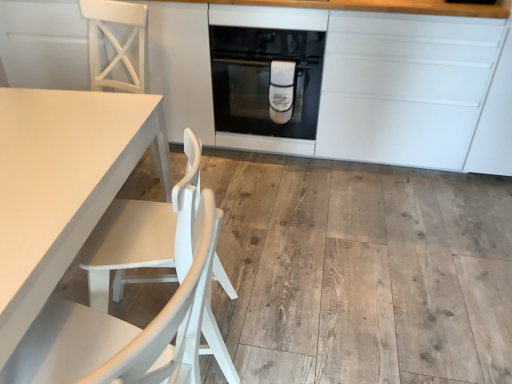
What is the approximate width of white matte wood chair at lower left, the 2th chair viewed from the back?

white matte wood chair at lower left, the 2th chair viewed from the back, is 22.01 inches wide.

I want to click on white matte wood chair at lower left, the first chair in the bottom-to-top sequence, so click(x=127, y=332).

This screenshot has width=512, height=384. In order to click on white matte chair at left, placed as the second chair when sorted from bottom to top in this screenshot , I will do `click(115, 40)`.

Describe the element at coordinates (357, 84) in the screenshot. I see `white matte cabinetry at center` at that location.

Describe the element at coordinates (264, 79) in the screenshot. The height and width of the screenshot is (384, 512). I see `black glass oven at center` at that location.

What is the approximate width of black glass oven at center?

black glass oven at center is 63.31 centimeters wide.

In order to click on white matte table at left in this screenshot , I will do `click(63, 184)`.

Does point (95, 59) come behind point (316, 71)?

Yes.

Where is `home appliance behind the white matte chair at left, placed as the second chair when sorted from bottom to top`? The height and width of the screenshot is (384, 512). home appliance behind the white matte chair at left, placed as the second chair when sorted from bottom to top is located at coordinates (264, 79).

Looking at their sizes, would you say white matte chair at left, positioned as the first chair in back-to-front order, is wider or thinner than black glass oven at center?

In the image, white matte chair at left, positioned as the first chair in back-to-front order, appears to be more narrow than black glass oven at center.

From the picture: From the image's perspective, is white matte chair at left, the second chair in the front-to-back sequence, on top of black glass oven at center?

No, from the image's perspective, white matte chair at left, the second chair in the front-to-back sequence, is not above black glass oven at center.

Which object is thinner, white matte cabinetry at center or white matte table at left?

white matte cabinetry at center is thinner.

Does white matte cabinetry at center turn towards white matte table at left?

Yes, white matte cabinetry at center is turned towards white matte table at left.

Between white matte cabinetry at center and white matte table at left, which one appears on the right side from the viewer's perspective?

Positioned to the right is white matte cabinetry at center.

What's the angular difference between white matte cabinetry at center and white matte table at left's facing directions?

The facing directions of white matte cabinetry at center and white matte table at left are 94.2 degrees apart.

Is white matte chair at left, placed as the second chair when sorted from bottom to top, not within white matte wood chair at lower left, the 2th chair in the top-to-bottom sequence?

Yes.

Is point (128, 85) more distant than point (90, 369)?

Yes, point (128, 85) is behind point (90, 369).

From the image's perspective, does white matte chair at left, the 1th chair positioned from the top, appear lower than white matte wood chair at lower left, the 2th chair viewed from the back?

No, from the image's perspective, white matte chair at left, the 1th chair positioned from the top, is not below white matte wood chair at lower left, the 2th chair viewed from the back.

Is white matte table at left wider or thinner than white matte cabinetry at center?

white matte table at left is wider than white matte cabinetry at center.

Is white matte cabinetry at center at the back of white matte table at left?

white matte table at left is not turned away from white matte cabinetry at center.

Which is in front, white matte table at left or white matte cabinetry at center?

white matte table at left is closer to the camera.

Is white matte table at left inside or outside of white matte cabinetry at center?

white matte table at left is spatially situated outside white matte cabinetry at center.

This screenshot has width=512, height=384. What are the coordinates of `home appliance behind the white matte wood chair at lower left, the 2th chair viewed from the back` in the screenshot? It's located at (264, 79).

From the image's perspective, is black glass oven at center below white matte wood chair at lower left, the 2th chair viewed from the back?

No, from the image's perspective, black glass oven at center is not beneath white matte wood chair at lower left, the 2th chair viewed from the back.

Is black glass oven at center facing towards white matte wood chair at lower left, the 2th chair viewed from the back?

Yes, black glass oven at center is turned towards white matte wood chair at lower left, the 2th chair viewed from the back.

Identify the location of chair above the white matte wood chair at lower left, the 2th chair in the top-to-bottom sequence (from the image's perspective). (115, 40).

Considering the relative sizes of white matte wood chair at lower left, acting as the first chair starting from the front, and white matte chair at left, placed as the second chair when sorted from bottom to top, in the image provided, is white matte wood chair at lower left, acting as the first chair starting from the front, shorter than white matte chair at left, placed as the second chair when sorted from bottom to top,?

No.

Is white matte wood chair at lower left, the first chair in the bottom-to-top sequence, closer to the viewer compared to white matte chair at left, the 1th chair positioned from the top?

Yes, white matte wood chair at lower left, the first chair in the bottom-to-top sequence, is in front of white matte chair at left, the 1th chair positioned from the top.

From the image's perspective, does white matte wood chair at lower left, the 2th chair in the top-to-bottom sequence, appear lower than white matte chair at left, the 1th chair positioned from the top?

Yes.

Considering the positions of objects white matte chair at left, the second chair in the front-to-back sequence, and white matte table at left in the image provided, who is more to the right, white matte chair at left, the second chair in the front-to-back sequence, or white matte table at left?

Positioned to the right is white matte table at left.

Is white matte chair at left, placed as the second chair when sorted from bottom to top, inside the boundaries of white matte table at left, or outside?

white matte chair at left, placed as the second chair when sorted from bottom to top, is not enclosed by white matte table at left.

Which object is further away from the camera, white matte chair at left, placed as the second chair when sorted from bottom to top, or white matte table at left?

Positioned behind is white matte chair at left, placed as the second chair when sorted from bottom to top.

The height and width of the screenshot is (384, 512). In order to click on home appliance below the white matte chair at left, placed as the second chair when sorted from bottom to top (from a real-world perspective) in this screenshot , I will do `click(264, 79)`.

The height and width of the screenshot is (384, 512). Identify the location of cabinetry behind the white matte table at left. (357, 84).

Based on their spatial positions, is white matte wood chair at lower left, the 2th chair in the top-to-bottom sequence, or white matte cabinetry at center further from black glass oven at center?

Among the two, white matte wood chair at lower left, the 2th chair in the top-to-bottom sequence, is located further to black glass oven at center.

Estimate the real-world distances between objects in this image. Which object is further from white matte wood chair at lower left, the 2th chair viewed from the back, white matte cabinetry at center or white matte table at left?

white matte cabinetry at center is positioned further to the anchor white matte wood chair at lower left, the 2th chair viewed from the back.

Looking at the image, which one is located closer to white matte cabinetry at center, white matte wood chair at lower left, the 2th chair viewed from the back, or white matte table at left?

white matte table at left is closer to white matte cabinetry at center.

Which object lies nearer to the anchor point black glass oven at center, white matte table at left or white matte chair at left, the second chair in the front-to-back sequence?

The object closer to black glass oven at center is white matte chair at left, the second chair in the front-to-back sequence.

Which object lies further to the anchor point white matte chair at left, the 1th chair positioned from the top, white matte cabinetry at center or white matte wood chair at lower left, the 2th chair viewed from the back?

white matte wood chair at lower left, the 2th chair viewed from the back.

When comparing their distances from white matte chair at left, the second chair in the front-to-back sequence, does white matte wood chair at lower left, the 2th chair viewed from the back, or black glass oven at center seem further?

The object further to white matte chair at left, the second chair in the front-to-back sequence, is white matte wood chair at lower left, the 2th chair viewed from the back.

Which object lies nearer to the anchor point white matte wood chair at lower left, the 2th chair in the top-to-bottom sequence, black glass oven at center or white matte cabinetry at center?

Based on the image, black glass oven at center appears to be nearer to white matte wood chair at lower left, the 2th chair in the top-to-bottom sequence.

Looking at the image, which one is located further to white matte table at left, white matte chair at left, placed as the second chair when sorted from bottom to top, or black glass oven at center?

black glass oven at center lies further to white matte table at left than the other object.

The image size is (512, 384). I want to click on chair located between white matte table at left and black glass oven at center in the depth direction, so click(115, 40).

Identify the location of cabinetry between white matte table at left and black glass oven at center in the front-back direction. This screenshot has height=384, width=512. (357, 84).

Identify the location of table between white matte wood chair at lower left, the first chair in the bottom-to-top sequence, and white matte cabinetry at center, along the z-axis. This screenshot has width=512, height=384. (63, 184).

Locate an element on the screen. This screenshot has height=384, width=512. chair located between white matte table at left and white matte cabinetry at center in the depth direction is located at coordinates (115, 40).